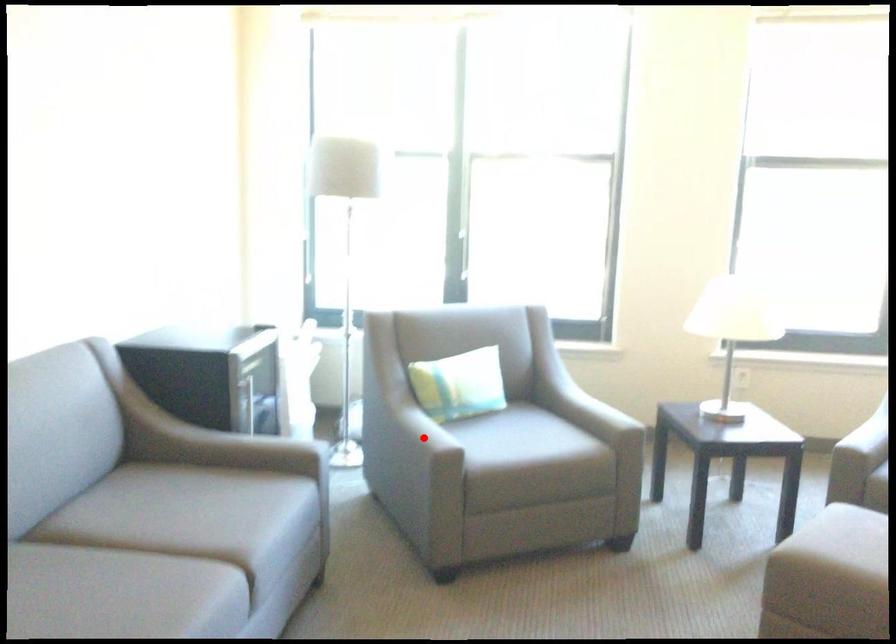
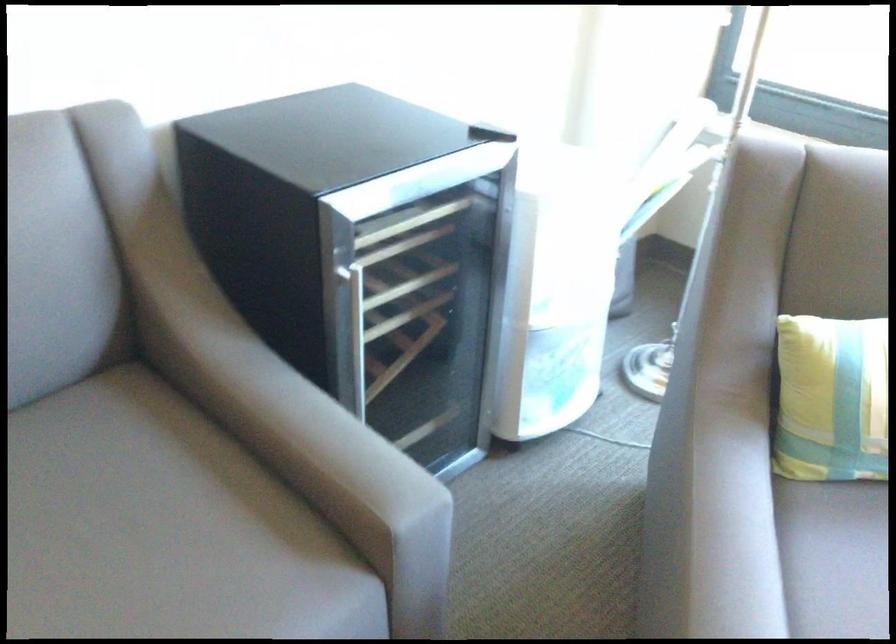
Where in the second image is the point corresponding to the highlighted location from the first image?

(837, 553)